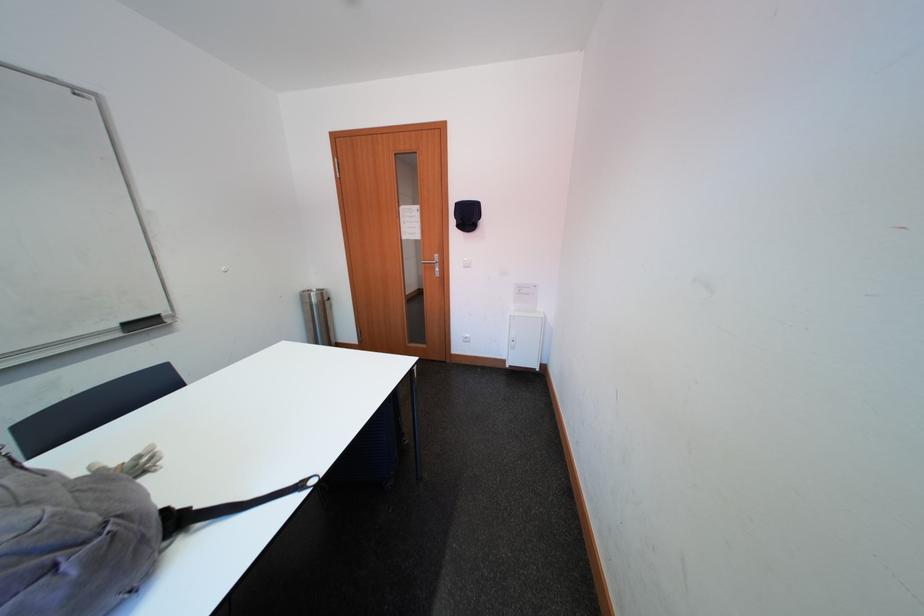
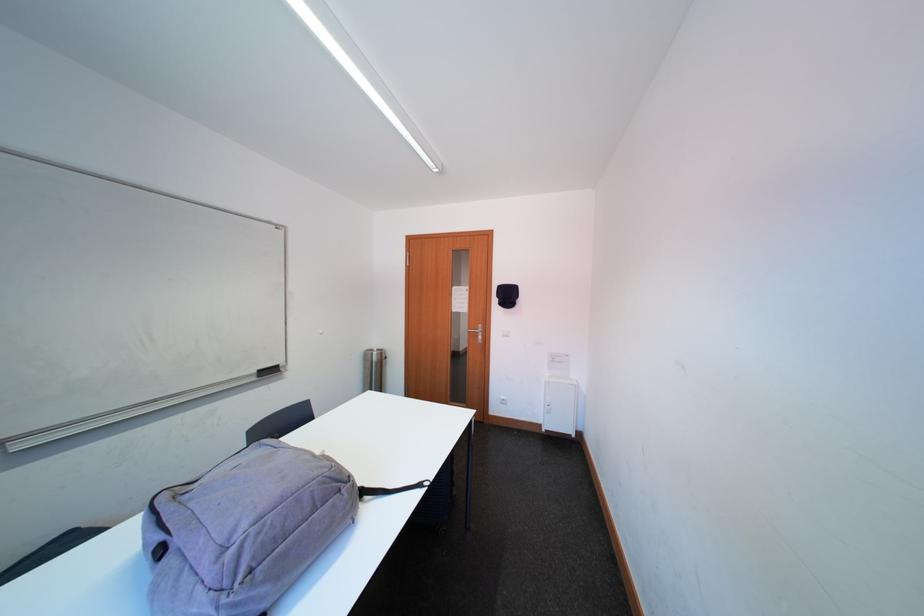
Where in the second image is the point corresponding to the point at 134,328 from the first image?

(269, 375)